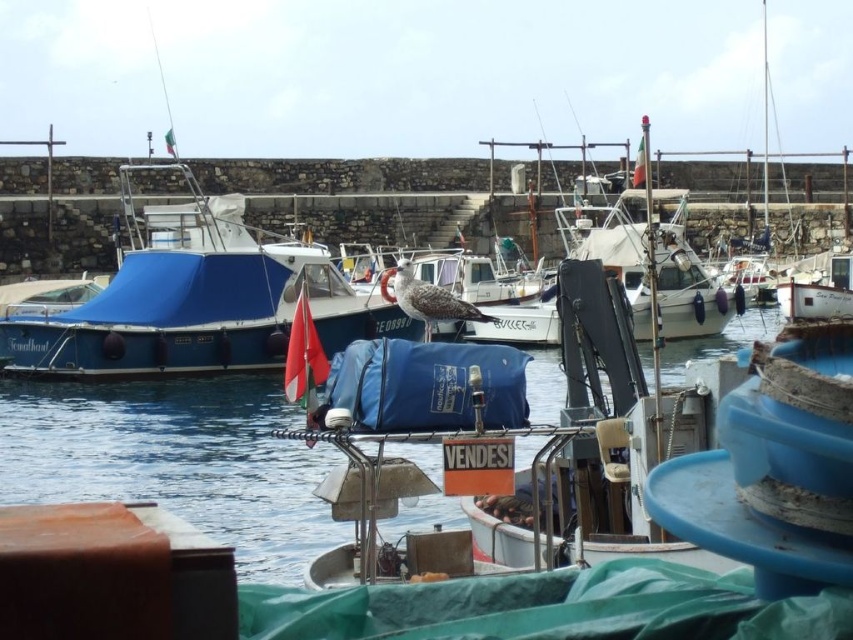
Question: Among these objects, which one is farthest from the camera?

Choices:
 (A) blue water at center
 (B) gray feathered seagull at center

Answer: (B)

Question: Which point is closer to the camera?

Choices:
 (A) pos(122,317)
 (B) pos(386,284)
 (C) pos(22,472)

Answer: (C)

Question: Can you confirm if blue water at center is positioned above blue tarpaulin boat at left?

Choices:
 (A) yes
 (B) no

Answer: (B)

Question: Which point is farther from the camera taking this photo?

Choices:
 (A) (312, 314)
 (B) (135, 480)

Answer: (A)

Question: Is blue tarpaulin boat at left wider than gray feathered seagull at center?

Choices:
 (A) yes
 (B) no

Answer: (A)

Question: Can you confirm if blue water at center is smaller than gray feathered seagull at center?

Choices:
 (A) yes
 (B) no

Answer: (B)